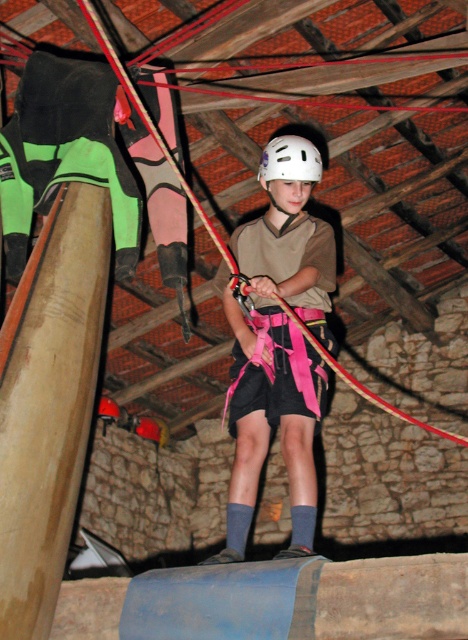
In the scene shown: Is pink fabric rope at center thinner than white matte helmet at center?

No, pink fabric rope at center is not thinner than white matte helmet at center.

Can you confirm if pink fabric rope at center is smaller than white matte helmet at center?

No.

Is point (299, 81) more distant than point (307, 176)?

Yes, it is.

At what (x,y) coordinates should I click in order to perform the action: click on pink fabric rope at center. Please return your answer as a coordinate pair (x, y). Looking at the image, I should click on 275,77.

Between brown wood beam at left and pink fabric harness at center, which one is positioned lower?

brown wood beam at left is lower down.

Between brown wood beam at left and pink fabric harness at center, which one appears on the right side from the viewer's perspective?

Positioned to the right is pink fabric harness at center.

You are a GUI agent. You are given a task and a screenshot of the screen. Output one action in this format:
    pyautogui.click(x=<x>, y=<y>)
    Task: Click on the brown wood beam at left
    Image resolution: width=468 pixels, height=640 pixels.
    Given the screenshot: What is the action you would take?
    pyautogui.click(x=49, y=401)

Does pink fabric rope at center have a lesser width compared to pink fabric harness at center?

In fact, pink fabric rope at center might be wider than pink fabric harness at center.

Is pink fabric rope at center above pink fabric harness at center?

Correct, pink fabric rope at center is located above pink fabric harness at center.

Between point (204, 52) and point (242, 490), which one is positioned in front?

Point (242, 490)

Locate an element on the screen. pink fabric rope at center is located at coordinates (275, 77).